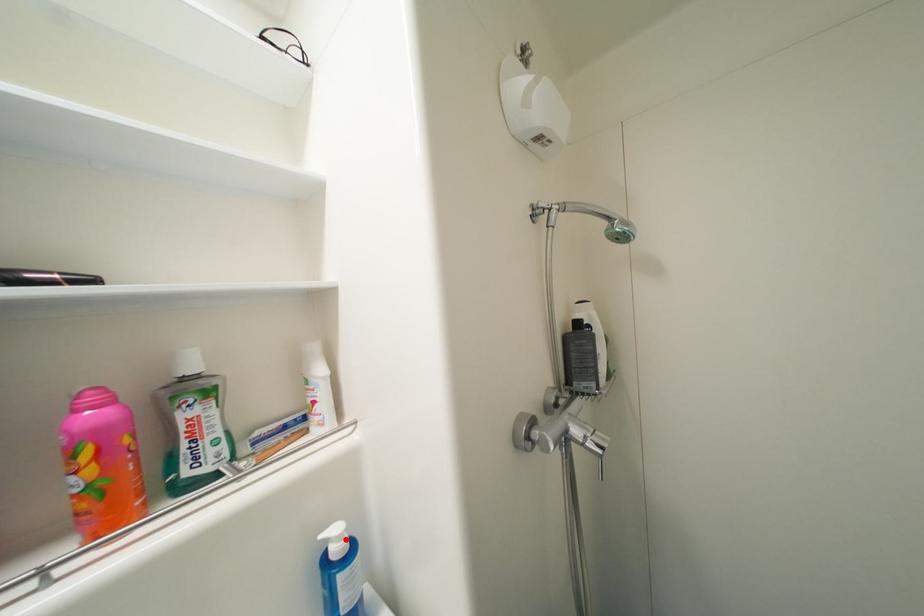
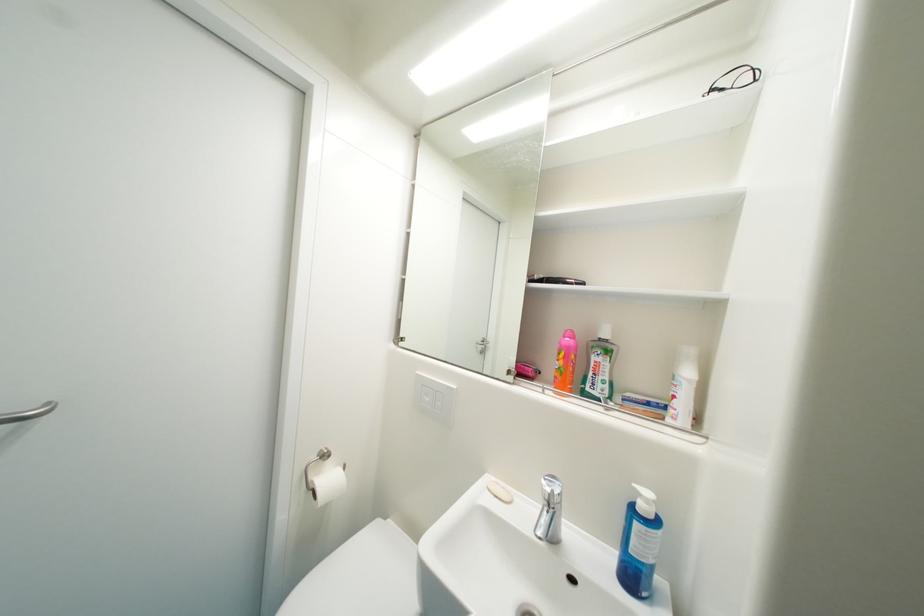
Find the pixel in the second image that matches the highlighted location in the first image.

(653, 503)